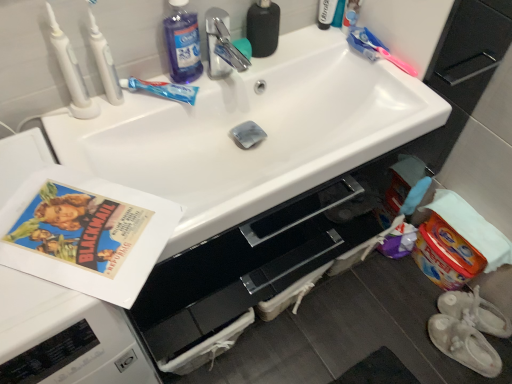
Image resolution: width=512 pixels, height=384 pixels. What are the coordinates of `unoccupied region to the right of white plastic toothbrush at upper left, the second toothbrush viewed from the left` in the screenshot? It's located at (180, 95).